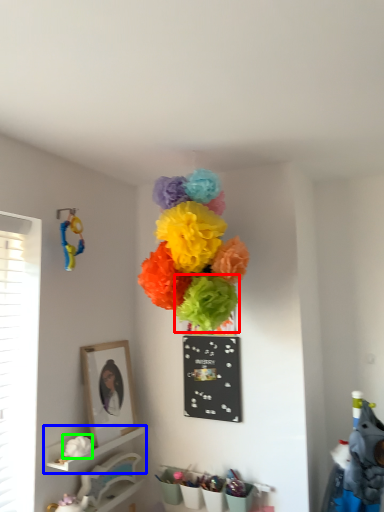
Question: Which object is positioned closest to flower (highlighted by a red box)? Select from shelf (highlighted by a blue box) and flower (highlighted by a green box).

Choices:
 (A) shelf
 (B) flower

Answer: (B)